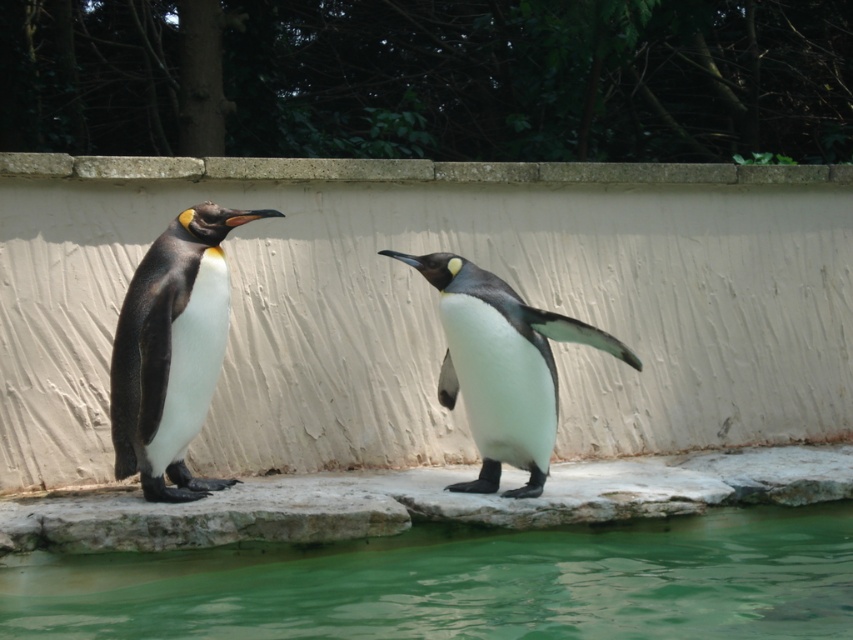
You are a zookeeper observing the penguins. You need to determine if the matte black penguin at left can reach the smooth concrete ledge at upper center. Based on their sizes, can it reach the ledge?

The matte black penguin at left is taller than the smooth concrete ledge at upper center, so it is possible that the penguin can reach the ledge.

You are a zookeeper observing the penguins at the enclosure. You notice the white matte penguin at center and the green liquid water at lower center. Which object is positioned to the left of the other?

The green liquid water at lower center is to the left of the white matte penguin at center.